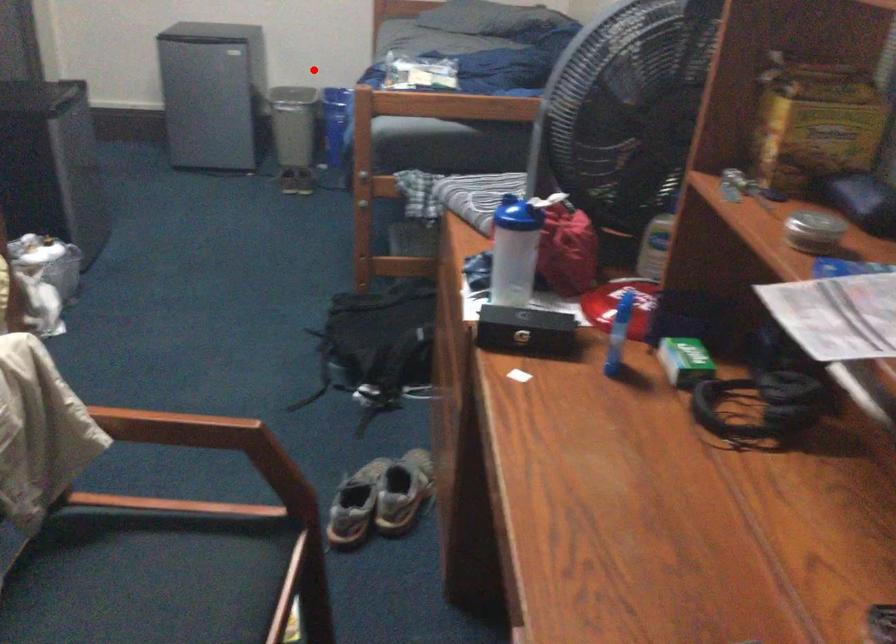
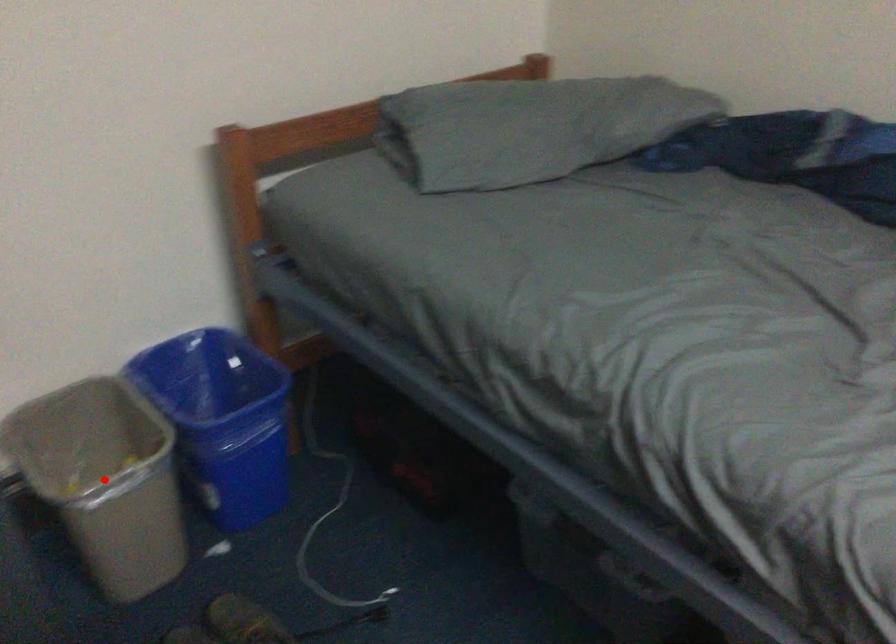
I am providing you with two images of the same scene from different viewpoints. A red point is marked on the first image and another point is marked on the second image. Do the highlighted points in image1 and image2 indicate the same real-world spot?

No